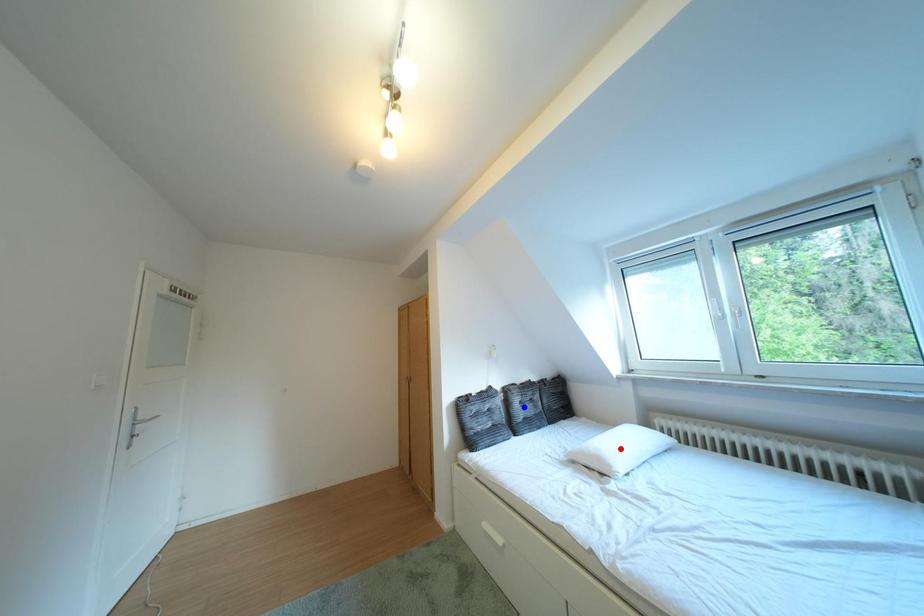
Question: Two points are marked on the image. Which point is closer to the camera?

Choices:
 (A) Blue point is closer.
 (B) Red point is closer.

Answer: (B)